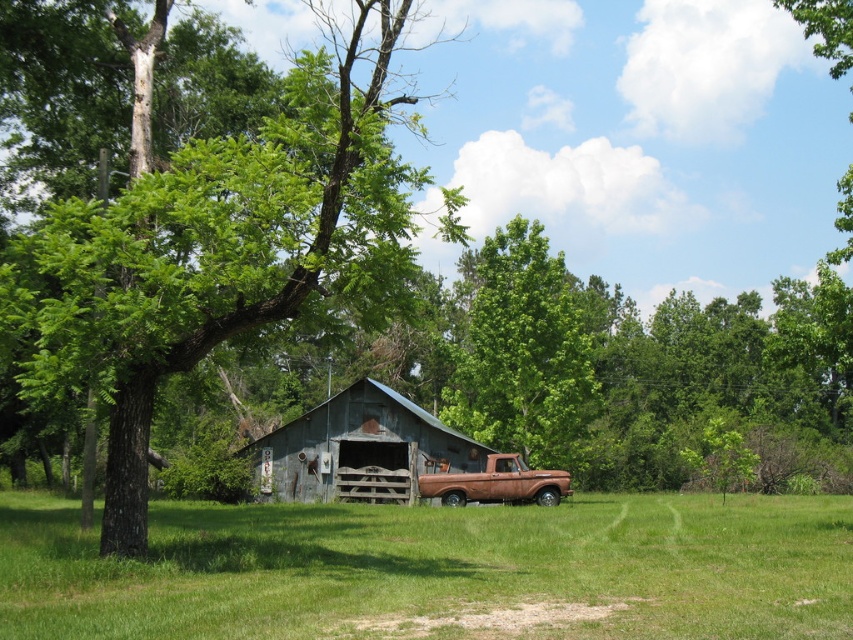
You are standing in the field and want to take a photo of the rusty metal barn at center and the rusty metal truck at center. If you want the truck to appear higher in the frame than the barn, where should you position your camera relative to the two objects?

The rusty metal barn at center is below the rusty metal truck at center, so to make the truck appear higher in the frame than the barn, position your camera lower than the barn. This way, the truck, being above the barn, will naturally appear higher in the photo.

You are a farmer who needs to move a heavy equipment from the green grass at lower center to the rusty metal barn at center. The equipment requires a clear path of at least 12 meters to operate safely. Based on the scene, can you safely move the equipment along the path between them?

The distance between the green grass at lower center and the rusty metal barn at center is 11.73 meters, which is shorter than the required 12 meters. Therefore, moving the equipment along this path may not be safe due to insufficient clearance.

You are a farmer who needs to move a large piece of equipment from the rusty metal barn at center to the rusty metal truck at center. Based on the scene, can the equipment fit inside the truck bed?

The rusty metal barn at center is larger in size compared to the rusty metal truck at center. Since the barn is bigger, it is possible that the equipment stored inside may not fit into the smaller truck bed.